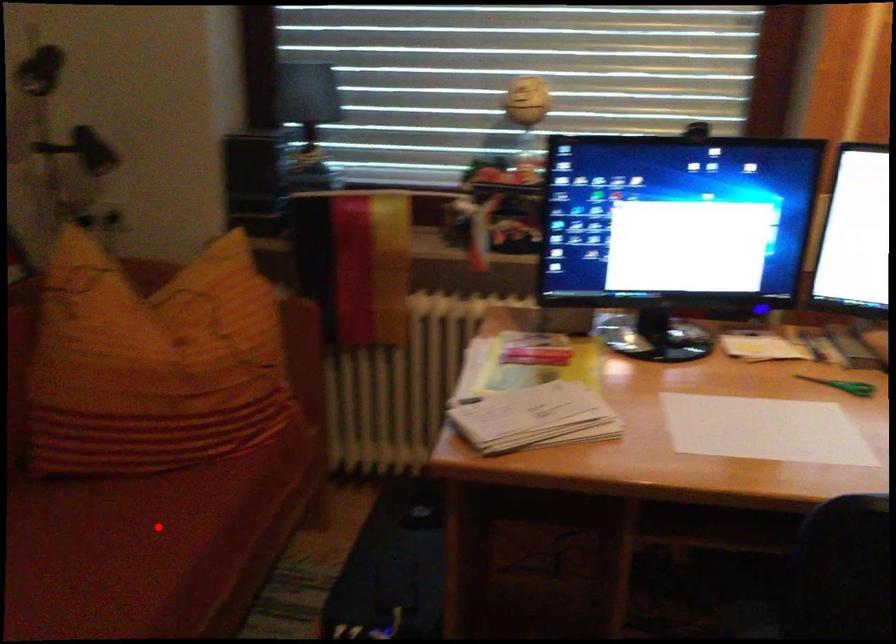
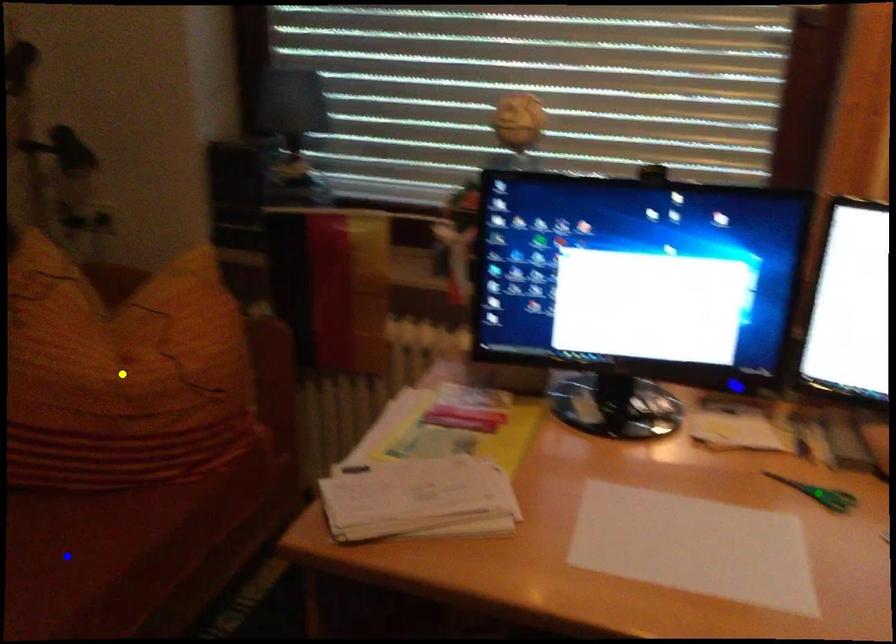
Question: I am providing you with two images of the same scene from different viewpoints. A red point is marked on the first image. You are given multiple points on the second image. Which point in image 2 represents the same 3d spot as the red point in image 1?

Choices:
 (A) yellow point
 (B) blue point
 (C) green point

Answer: (B)